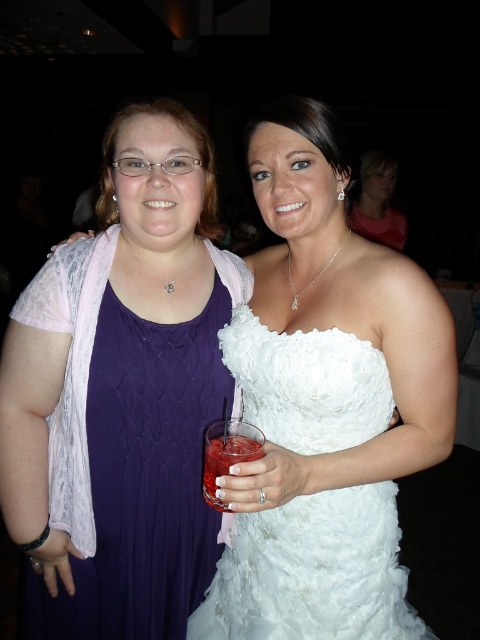
Question: Does matte purple dress at center have a smaller size compared to purple knit dress at left?

Choices:
 (A) no
 (B) yes

Answer: (A)

Question: Which object is the farthest from the matte white dress at upper center?

Choices:
 (A) white lace dress at center
 (B) matte purple dress at center
 (C) purple knit dress at left
 (D) translucent glass drink at center

Answer: (D)

Question: From the image, what is the correct spatial relationship of purple knit dress at left in relation to matte white dress at upper center?

Choices:
 (A) above
 (B) below

Answer: (B)

Question: Based on their relative distances, which object is nearer to the purple knit dress at left?

Choices:
 (A) matte purple dress at center
 (B) translucent glass drink at center
 (C) matte white dress at upper center

Answer: (A)

Question: Can you confirm if matte white dress at upper center is thinner than translucent glass drink at center?

Choices:
 (A) yes
 (B) no

Answer: (B)

Question: Estimate the real-world distances between objects in this image. Which object is closer to the translucent glass drink at center?

Choices:
 (A) matte white dress at upper center
 (B) matte purple dress at center
 (C) white lace dress at center

Answer: (C)